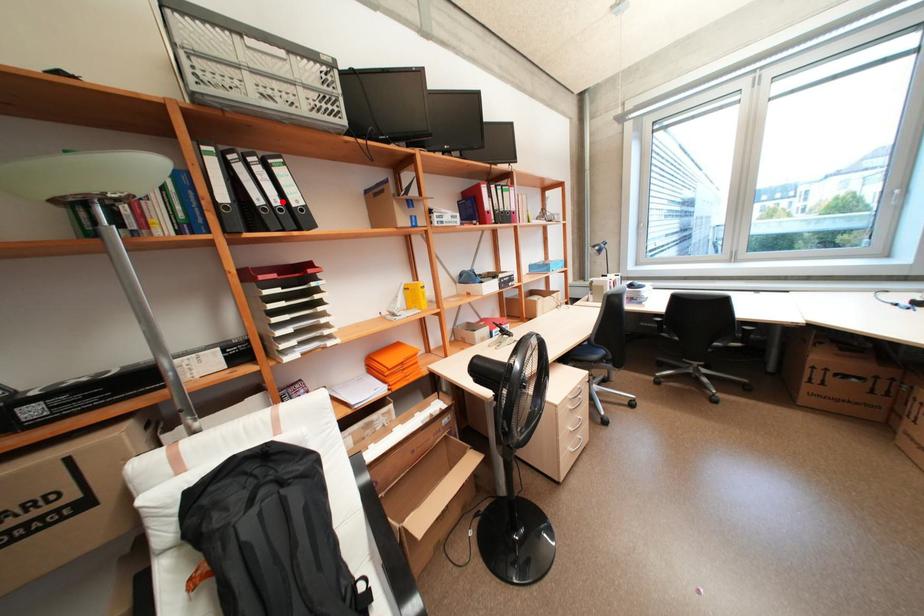
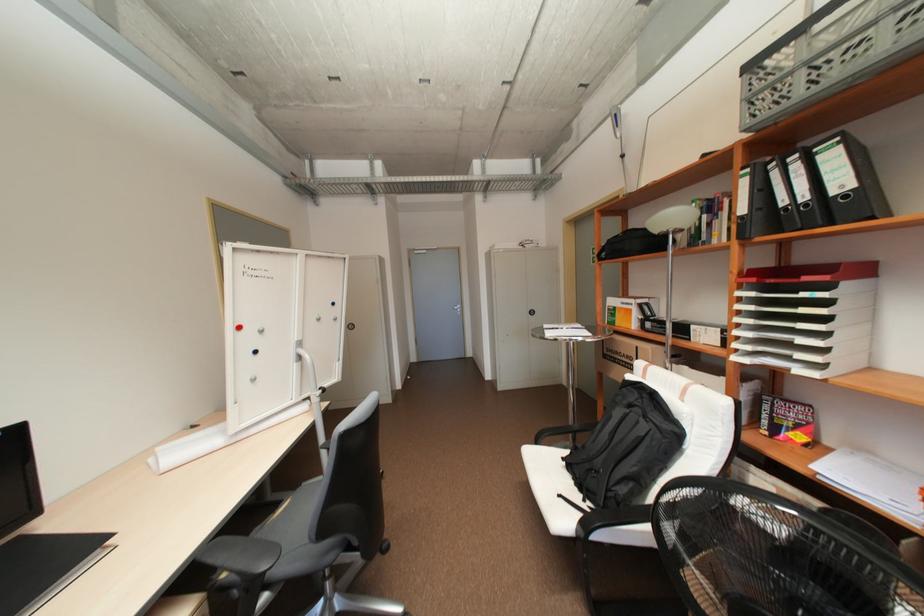
Where in the second image is the point corresponding to the highlighted location from the first image?

(810, 197)